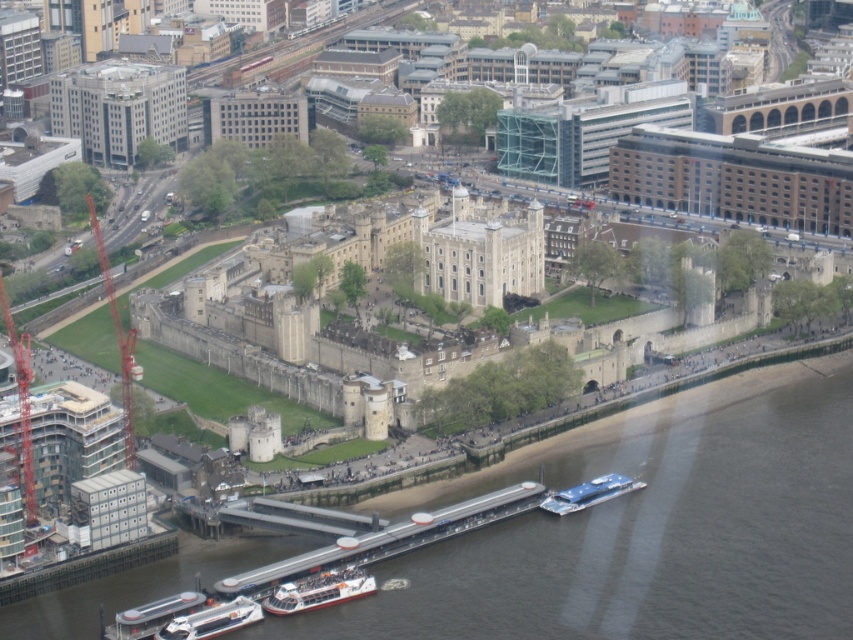
From the picture: You are a photographer taking an aerial shot of the fortress and the river. You have two points marked on your camera screen at coordinates point (117, 93) and point (611, 490). Which point is closer to your camera lens?

Point (117, 93) is further to the camera than point (611, 490). Wait, no. The description says the first point is further to the camera than the second. So the second point is closer. Therefore, the answer should be point (611, 490) is closer to the camera lens because it is nearer to the camera compared to point (117, 93).

You are a tourist standing on the riverside promenade and want to take a photo of the white glossy boat at lower center. Where should you position yourself to capture the boat in the center of your photo?

To capture the white glossy boat at lower center in the center of your photo, position yourself directly in front of the boat at point (318,589).

You are standing at the fortress and looking towards the river. There is a point marked at coordinates (318,589). What object is located at this point?

The point at coordinates (318,589) corresponds to the white glossy boat at lower center.